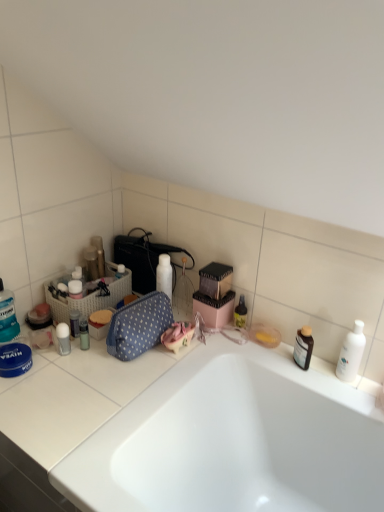
The image size is (384, 512). I want to click on free space in front of white glossy deodorant at left, which is the ninth toiletry in right-to-left order, so click(54, 386).